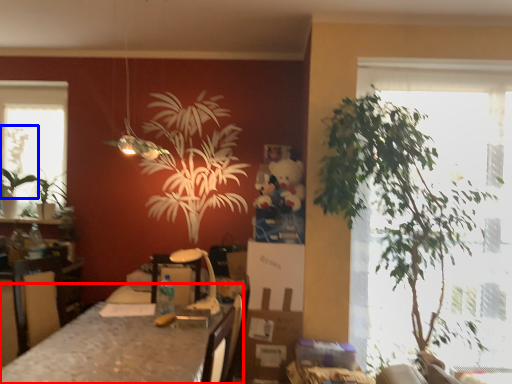
Question: Which of the following is the closest to the observer, table (highlighted by a red box) or plant (highlighted by a blue box)?

Choices:
 (A) table
 (B) plant

Answer: (A)